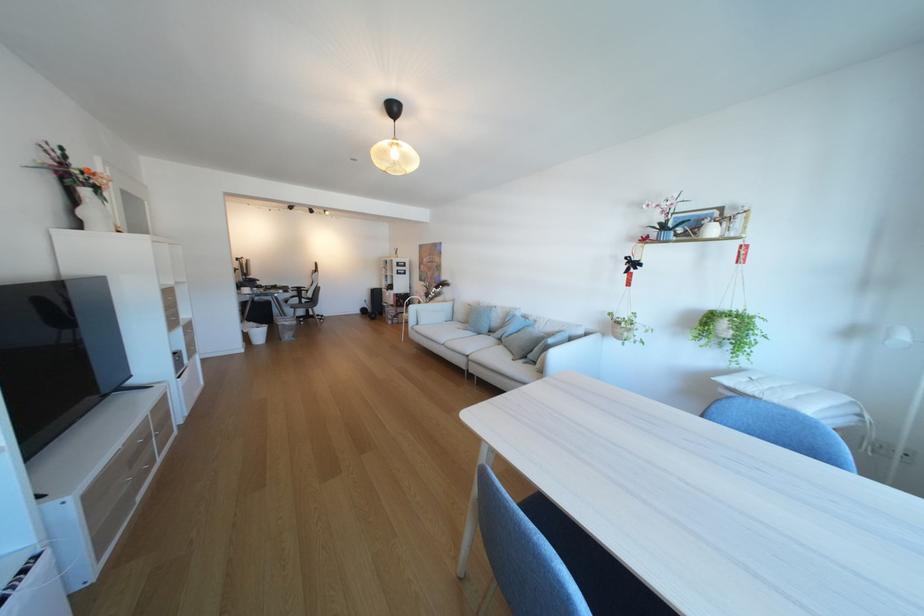
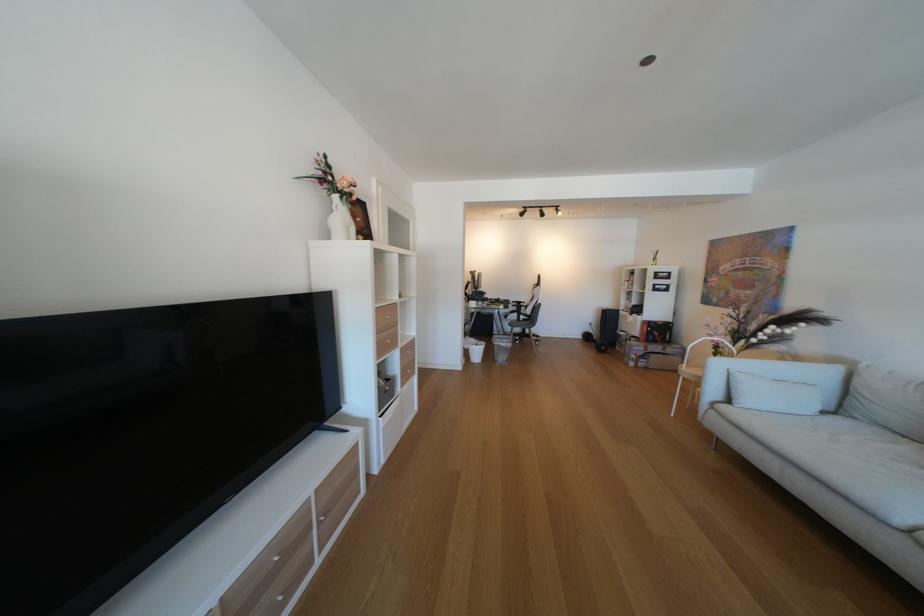
Where in the second image is the point corresponding to (x=58, y=154) from the first image?

(331, 166)